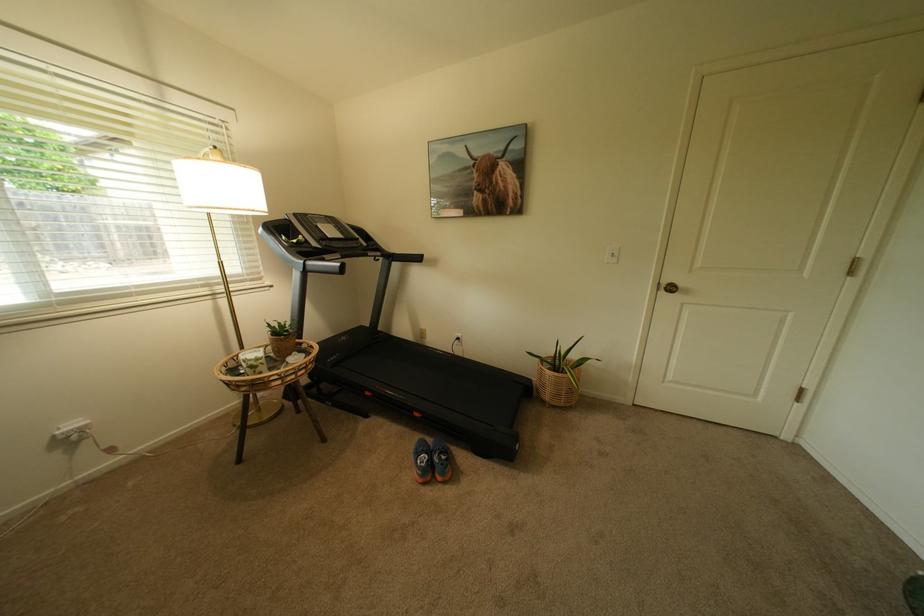
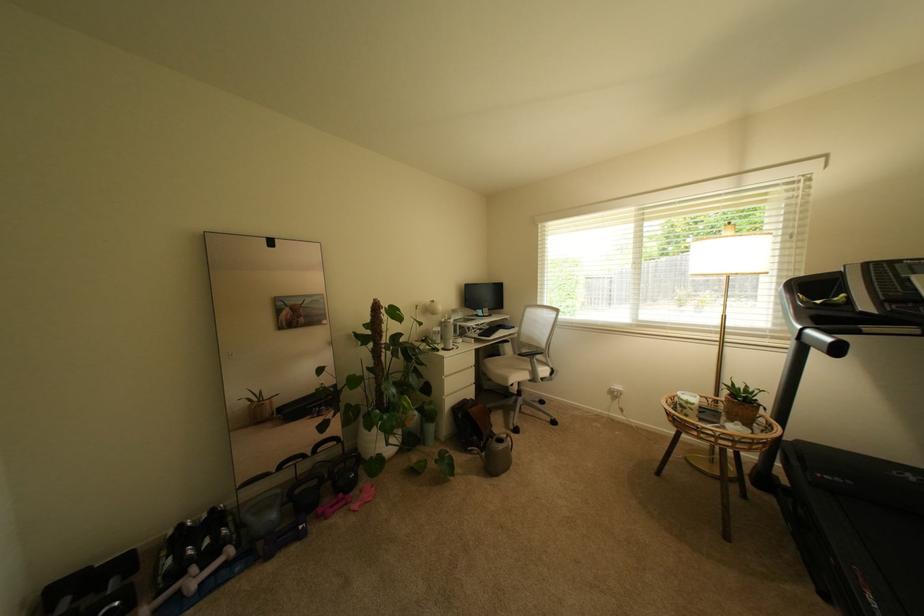
The point at (302, 241) is marked in the first image. Where is the corresponding point in the second image?

(827, 302)